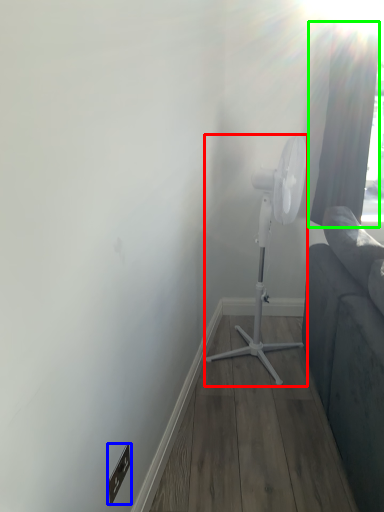
Question: Estimate the real-world distances between objects in this image. Which object is closer to mechanical fan (highlighted by a red box), electric outlet (highlighted by a blue box) or curtain (highlighted by a green box)?

Choices:
 (A) electric outlet
 (B) curtain

Answer: (B)